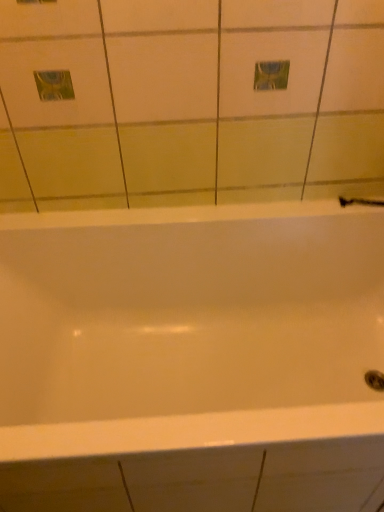
The width and height of the screenshot is (384, 512). I want to click on white glossy shower at right, so click(360, 202).

What do you see at coordinates (360, 202) in the screenshot?
I see `white glossy shower at right` at bounding box center [360, 202].

Image resolution: width=384 pixels, height=512 pixels. Find the location of `white glossy bathtub at center`. white glossy bathtub at center is located at coordinates pos(192,359).

Measure the distance between white glossy bathtub at center and camera.

The distance of white glossy bathtub at center from camera is 1.04 meters.

Describe the element at coordinates (192, 359) in the screenshot. I see `white glossy bathtub at center` at that location.

Where is `white glossy shower at right`? white glossy shower at right is located at coordinates (360, 202).

Considering the positions of objects white glossy bathtub at center and white glossy shower at right in the image provided, who is more to the right, white glossy bathtub at center or white glossy shower at right?

From the viewer's perspective, white glossy shower at right appears more on the right side.

Does white glossy bathtub at center come in front of white glossy shower at right?

Yes.

Which is less distant, [35,490] or [342,200]?

Point [35,490]

From the image's perspective, is white glossy bathtub at center located beneath white glossy shower at right?

Yes, from the image's perspective, white glossy bathtub at center is beneath white glossy shower at right.

From a real-world perspective, is white glossy bathtub at center over white glossy shower at right?

No, from a real-world perspective, white glossy bathtub at center is not above white glossy shower at right.

Considering the relative sizes of white glossy bathtub at center and white glossy shower at right in the image provided, is white glossy bathtub at center wider than white glossy shower at right?

Correct, the width of white glossy bathtub at center exceeds that of white glossy shower at right.

Who is taller, white glossy bathtub at center or white glossy shower at right?

white glossy bathtub at center is taller.

Who is smaller, white glossy bathtub at center or white glossy shower at right?

With smaller size is white glossy shower at right.

Is white glossy bathtub at center spatially inside white glossy shower at right, or outside of it?

white glossy bathtub at center is not enclosed by white glossy shower at right.

Are white glossy bathtub at center and white glossy shower at right located far from each other?

No, white glossy bathtub at center is not far away from white glossy shower at right.

Is white glossy bathtub at center oriented towards white glossy shower at right?

No, white glossy bathtub at center is not turned towards white glossy shower at right.

Can you tell me how much white glossy bathtub at center and white glossy shower at right differ in facing direction?

The angular difference between white glossy bathtub at center and white glossy shower at right is 0.032 degrees.

At what (x,y) coordinates should I click in order to perform the action: click on shower behind the white glossy bathtub at center. Please return your answer as a coordinate pair (x, y). The image size is (384, 512). Looking at the image, I should click on (360, 202).

Is white glossy shower at right at the right side of white glossy bathtub at center?

Yes, white glossy shower at right is to the right of white glossy bathtub at center.

Which object is further away from the camera, white glossy shower at right or white glossy bathtub at center?

white glossy shower at right.

Does point (349, 199) appear closer or farther from the camera than point (220, 337)?

Point (349, 199).

From the image's perspective, between white glossy shower at right and white glossy bathtub at center, who is located below?

white glossy bathtub at center, from the image's perspective.

From a real-world perspective, between white glossy shower at right and white glossy bathtub at center, who is vertically higher?

From a 3D spatial view, white glossy shower at right is above.

Which object is thinner, white glossy shower at right or white glossy bathtub at center?

Thinner between the two is white glossy shower at right.

Which of these two, white glossy shower at right or white glossy bathtub at center, stands shorter?

white glossy shower at right.

Who is bigger, white glossy shower at right or white glossy bathtub at center?

white glossy bathtub at center is bigger.

Would you say white glossy shower at right is outside white glossy bathtub at center?

No, white glossy shower at right is not outside of white glossy bathtub at center.

Is white glossy shower at right next to white glossy bathtub at center?

No, white glossy shower at right is not making contact with white glossy bathtub at center.

Looking at this image, is white glossy shower at right looking in the opposite direction of white glossy bathtub at center?

Absolutely, white glossy shower at right is directed away from white glossy bathtub at center.

How many degrees apart are the facing directions of white glossy shower at right and white glossy bathtub at center?

The facing directions of white glossy shower at right and white glossy bathtub at center are 0.032 degrees apart.

The height and width of the screenshot is (512, 384). I want to click on bathtub in front of the white glossy shower at right, so click(x=192, y=359).

At what (x,y) coordinates should I click in order to perform the action: click on bathtub in front of the white glossy shower at right. Please return your answer as a coordinate pair (x, y). The height and width of the screenshot is (512, 384). Looking at the image, I should click on (192, 359).

At what (x,y) coordinates should I click in order to perform the action: click on shower above the white glossy bathtub at center (from the image's perspective). Please return your answer as a coordinate pair (x, y). This screenshot has height=512, width=384. Looking at the image, I should click on (360, 202).